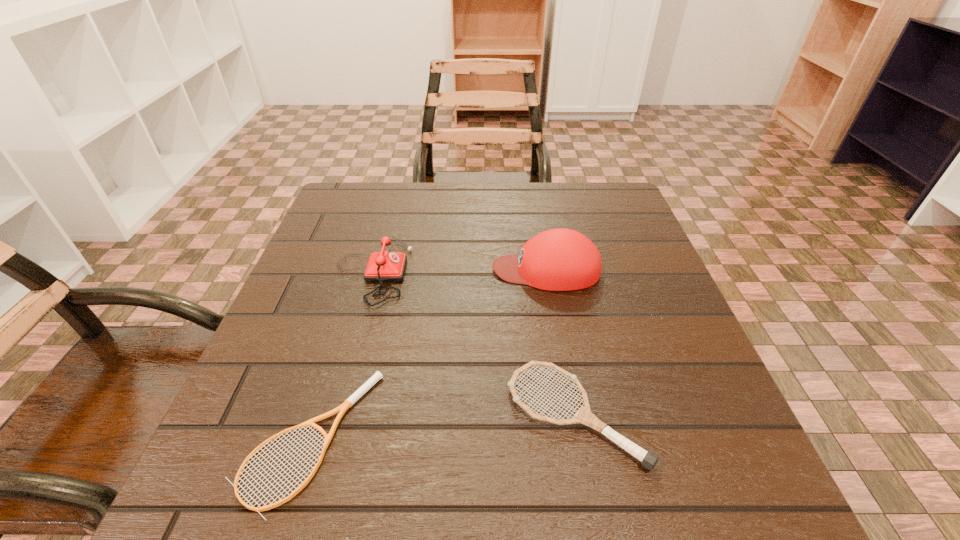
Find the location of a particular element. Image resolution: width=960 pixels, height=540 pixels. vacant space at the left edge is located at coordinates (359, 278).

Where is `vacant space at the right edge`? vacant space at the right edge is located at coordinates (641, 306).

Where is `vacant space at the far left corner of the desktop`? vacant space at the far left corner of the desktop is located at coordinates [318, 230].

You are a GUI agent. You are given a task and a screenshot of the screen. Output one action in this format:
    pyautogui.click(x=<x>, y=<y>)
    Task: Click on the vacant space at the near left corner of the desktop
    This screenshot has height=540, width=960.
    Given the screenshot: What is the action you would take?
    pyautogui.click(x=293, y=460)

In the image, there is a desktop. Identify the location of vacant space at the far right corner. (613, 184).

Locate an element on the screen. vacant space at the near right corner of the desktop is located at coordinates click(x=748, y=492).

Where is `free spot between the third tallest object and the baseball cap`? The height and width of the screenshot is (540, 960). free spot between the third tallest object and the baseball cap is located at coordinates (561, 342).

What are the coordinates of `free spot between the tallest object and the telephone` in the screenshot? It's located at (459, 270).

This screenshot has width=960, height=540. Identify the location of free space between the third shortest object and the right tennis racket. (473, 343).

Locate an element on the screen. empty location between the shortest object and the second tallest object is located at coordinates (340, 355).